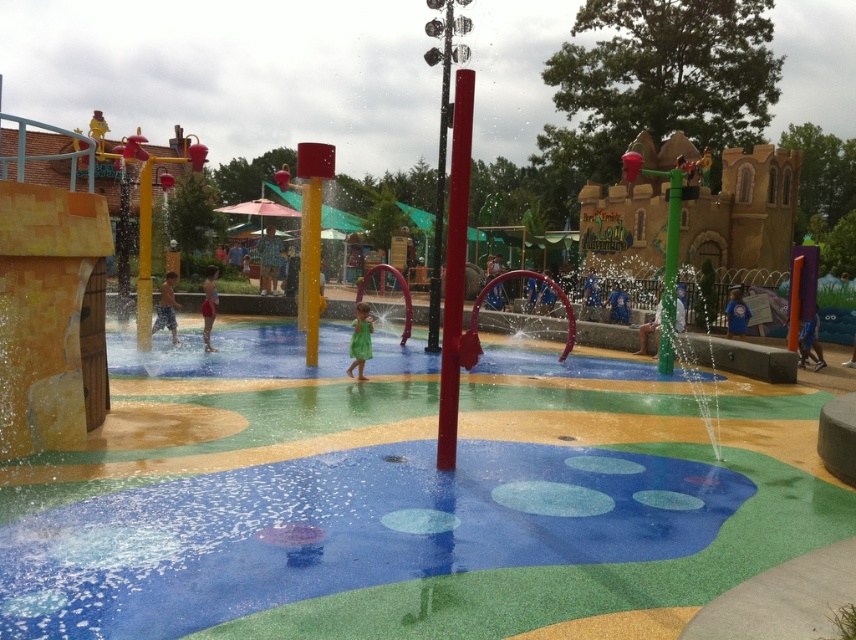
Is point (369, 333) farther from viewer compared to point (210, 307)?

No, it is in front of (210, 307).

Is green matte dress at center to the right of green fabric dress at center from the viewer's perspective?

Correct, you'll find green matte dress at center to the right of green fabric dress at center.

Which is in front, point (367, 321) or point (206, 317)?

Positioned in front is point (367, 321).

Identify the location of green matte dress at center. (360, 340).

Is green matte dress at center shorter than smooth tan skin at center?

No, green matte dress at center is not shorter than smooth tan skin at center.

Which is more to the right, green matte dress at center or smooth tan skin at center?

Positioned to the right is green matte dress at center.

Does point (364, 356) come in front of point (169, 285)?

Yes.

The width and height of the screenshot is (856, 640). Identify the location of green matte dress at center. (360, 340).

Between smooth tan skin at center and green fabric dress at center, which one has less height?

smooth tan skin at center

The height and width of the screenshot is (640, 856). In order to click on smooth tan skin at center in this screenshot , I will do `click(165, 307)`.

Between point (162, 298) and point (205, 282), which one is positioned behind?

The point (205, 282) is behind.

Image resolution: width=856 pixels, height=640 pixels. In order to click on smooth tan skin at center in this screenshot , I will do `click(165, 307)`.